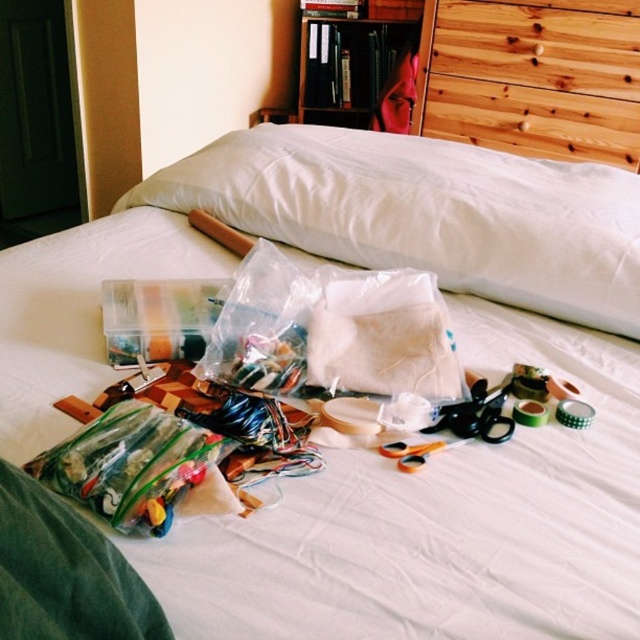
You are standing at the bed and want to place a new item at point (532, 77). What object is already there?

The wooden hoop is already at point (532, 77).